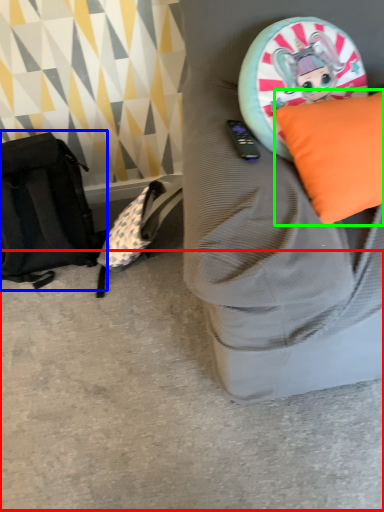
Question: Which is nearer to the concrete (highlighted by a red box)? messenger bag (highlighted by a blue box) or pillow (highlighted by a green box).

Choices:
 (A) messenger bag
 (B) pillow

Answer: (A)